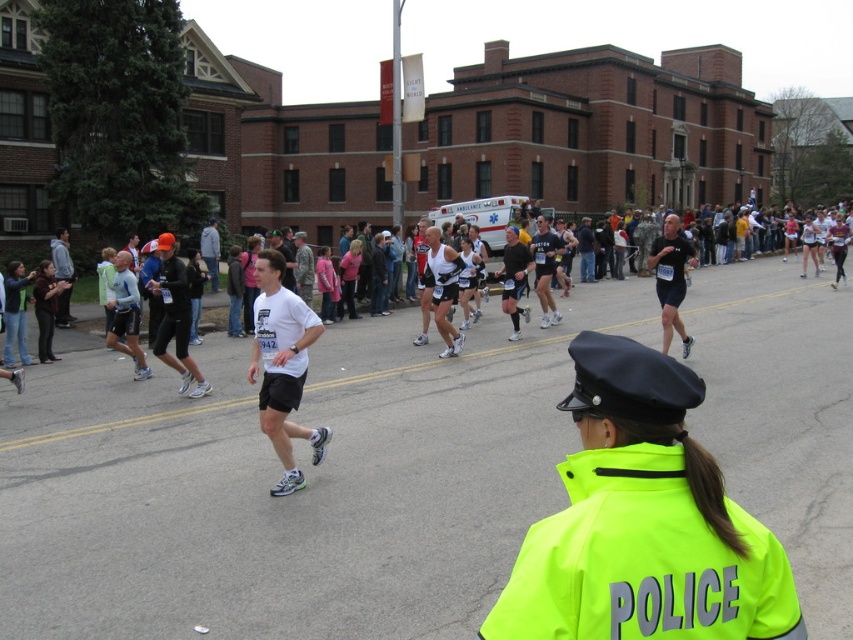
Question: Which of the following is the farthest from the observer?

Choices:
 (A) (651, 435)
 (B) (665, 301)

Answer: (B)

Question: Can you confirm if neon yellow jacket at center is positioned to the left of matte black shorts at center?

Choices:
 (A) no
 (B) yes

Answer: (B)

Question: Which of the following is the closest to the observer?

Choices:
 (A) (575, 380)
 (B) (668, 312)

Answer: (A)

Question: Considering the relative positions of neon yellow jacket at center and matte black shorts at center in the image provided, where is neon yellow jacket at center located with respect to matte black shorts at center?

Choices:
 (A) above
 (B) below

Answer: (B)

Question: Which point is closer to the camera taking this photo?

Choices:
 (A) (531, 538)
 (B) (680, 266)

Answer: (A)

Question: Is neon yellow jacket at center bigger than matte black shorts at center?

Choices:
 (A) no
 (B) yes

Answer: (A)